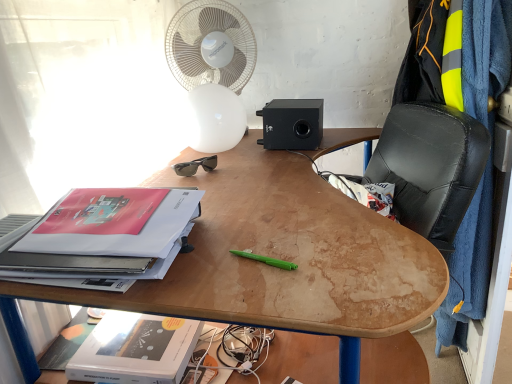
Question: Is black plastic speaker at upper center bigger or smaller than blue fleece blanket at right?

Choices:
 (A) big
 (B) small

Answer: (B)

Question: Relative to blue fleece blanket at right, is black plastic speaker at upper center in front or behind?

Choices:
 (A) behind
 (B) front

Answer: (A)

Question: Which object is positioned closest to the wooden desk at center?

Choices:
 (A) green plastic pen at center
 (B) black plastic speaker at upper center
 (C) white plastic fan at upper center
 (D) black plastic sunglasses at upper center
 (E) matte paper stack at left, which is counted as the second paperback book, starting from the bottom

Answer: (E)

Question: Estimate the real-world distances between objects in this image. Which object is farther from the black leather computer chair at center?

Choices:
 (A) black plastic sunglasses at upper center
 (B) blue fleece blanket at right
 (C) green plastic pen at center
 (D) black plastic speaker at upper center
 (E) wooden desk at center

Answer: (C)